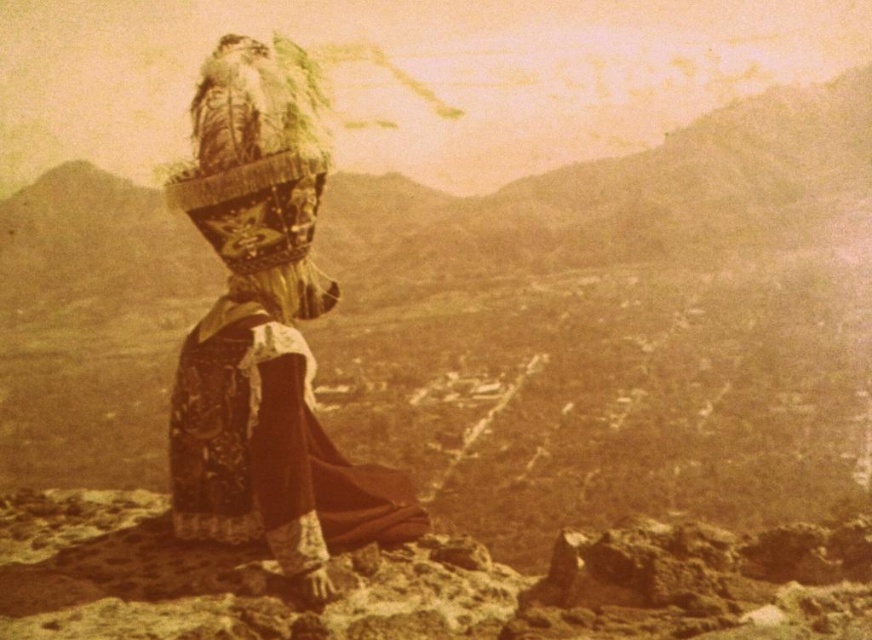
The width and height of the screenshot is (872, 640). In order to click on velvet maroon dress at center in this screenshot , I will do `click(270, 449)`.

Identify the location of velvet maroon dress at center. Image resolution: width=872 pixels, height=640 pixels. (270, 449).

Locate an element on the screen. The image size is (872, 640). velvet maroon dress at center is located at coordinates (270, 449).

Which is below, matte brown dress at center or fuzzy fur headdress at center?

matte brown dress at center is lower down.

Is matte brown dress at center shorter than fuzzy fur headdress at center?

In fact, matte brown dress at center may be taller than fuzzy fur headdress at center.

Where is `matte brown dress at center`? The width and height of the screenshot is (872, 640). matte brown dress at center is located at coordinates (264, 332).

Is matte brown dress at center taller than velvet maroon dress at center?

Yes.

Based on the photo, does matte brown dress at center have a greater width compared to velvet maroon dress at center?

Yes.

This screenshot has width=872, height=640. In order to click on matte brown dress at center in this screenshot , I will do `click(264, 332)`.